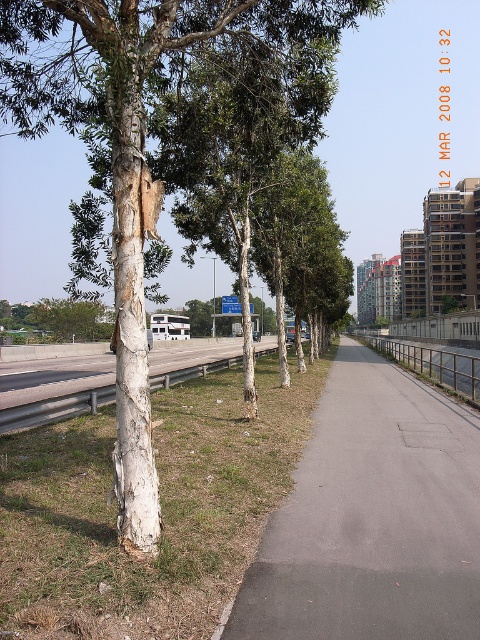
You are standing on the paved pathway near the trees with white bark. You notice two points marked on the image. One is at coordinate point (416, 550) and the other at point (40, 323). Which point is closer to you?

Point (416, 550) is closer to the viewer than point (40, 323).

You are a gardener who needs to plant flowers in the green grass at lower left and the gray asphalt pavement at center. Which location would you choose for better plant growth, and why?

The green grass at lower left is thinner than the gray asphalt pavement at center. However, asphalt is not suitable for planting as it lacks soil. Therefore, the gardener should choose the green grass at lower left despite its thinness, as it provides some soil for plant growth.